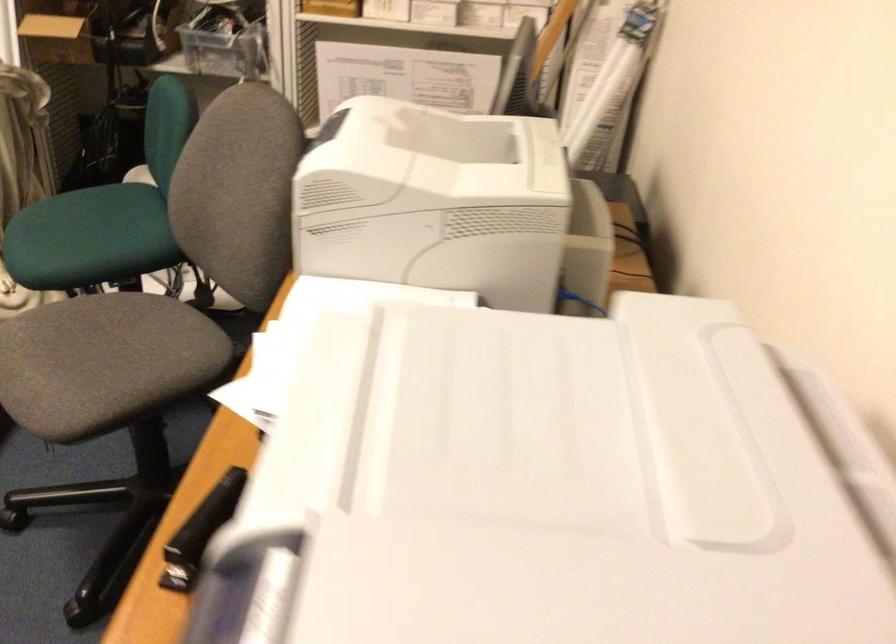
This screenshot has height=644, width=896. Find the location of `printer lid handle`. printer lid handle is located at coordinates (593, 491).